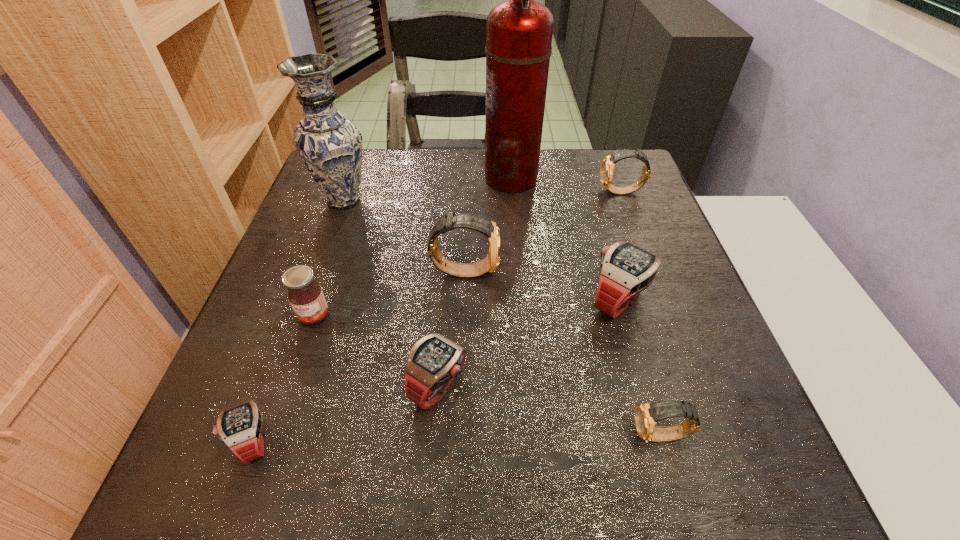
Locate an element on the screen. vacant area located 0.100m on the back of the farthest red watch is located at coordinates click(603, 246).

Image resolution: width=960 pixels, height=540 pixels. I want to click on free space located on the face of the farthest gold watch, so click(x=475, y=192).

Find the location of a particular element. The image size is (960, 540). vacant space located 0.250m on the face of the farthest gold watch is located at coordinates (505, 192).

Identify the location of vacant region located 0.260m on the face of the farthest gold watch. The height and width of the screenshot is (540, 960). (501, 192).

The image size is (960, 540). Identify the location of free space located 0.140m on the label side of the jam. (288, 393).

This screenshot has height=540, width=960. Identify the location of vacant space located 0.120m on the left of the second biggest red watch. (343, 386).

Locate an element on the screen. vacant space positioned 0.200m on the face of the smallest gold watch is located at coordinates (509, 436).

At what (x,y) coordinates should I click in order to perform the action: click on blank space located 0.090m on the face of the smallest gold watch. Please return your answer as a coordinate pair (x, y). This screenshot has width=960, height=540. Looking at the image, I should click on (577, 436).

Identify the location of vacant space situated on the face of the smallest gold watch. This screenshot has width=960, height=540. (459, 436).

This screenshot has width=960, height=540. In order to click on vacant space located 0.150m on the right of the smallest red watch in this screenshot , I will do `click(369, 440)`.